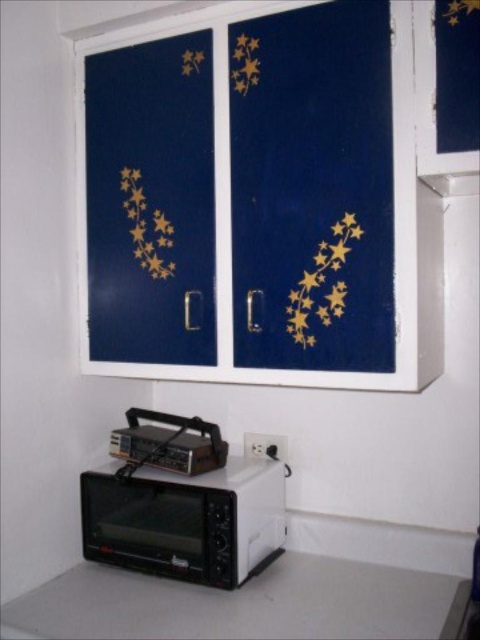
Does white matte countertop at lower center appear on the right side of metallic silver toaster oven at lower left?

Yes, white matte countertop at lower center is to the right of metallic silver toaster oven at lower left.

Which is behind, point (372, 628) or point (158, 435)?

The point (158, 435) is more distant.

Identify the location of white matte countertop at lower center. This screenshot has width=480, height=640. (239, 604).

Which is above, white matte countertop at lower center or gold metallic star at upper center?

gold metallic star at upper center is above.

How distant is white matte countertop at lower center from gold metallic star at upper center?

white matte countertop at lower center is 1.13 meters away from gold metallic star at upper center.

Between point (363, 576) and point (203, 60), which one is positioned behind?

Point (363, 576)

The height and width of the screenshot is (640, 480). Identify the location of white matte countertop at lower center. (239, 604).

Can you confirm if transparent glass window at upper right is thinner than gold metallic star at upper center?

No, transparent glass window at upper right is not thinner than gold metallic star at upper center.

How much distance is there between transparent glass window at upper right and gold metallic star at upper center?

transparent glass window at upper right and gold metallic star at upper center are 52.40 centimeters apart from each other.

Identify the location of transparent glass window at upper right. This screenshot has width=480, height=640. (432, 100).